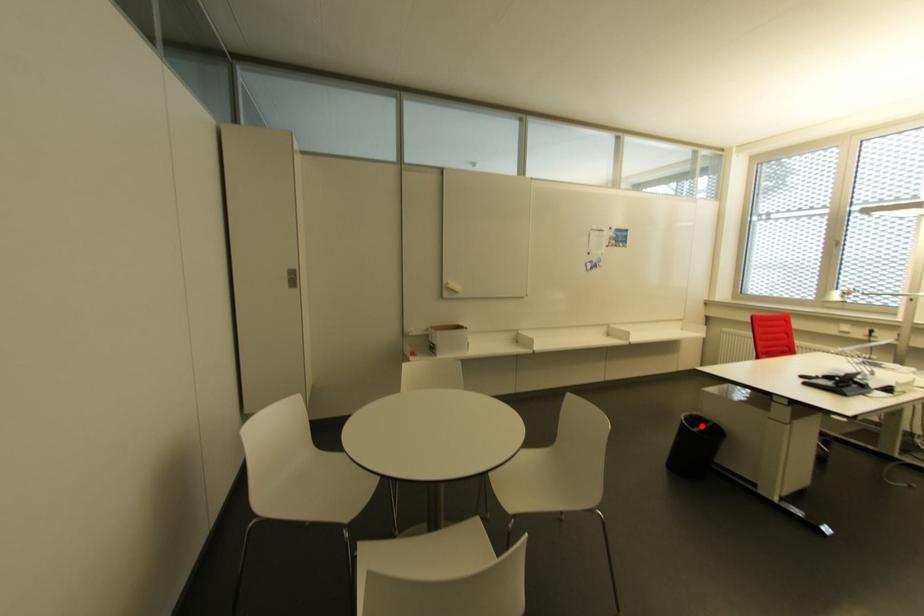
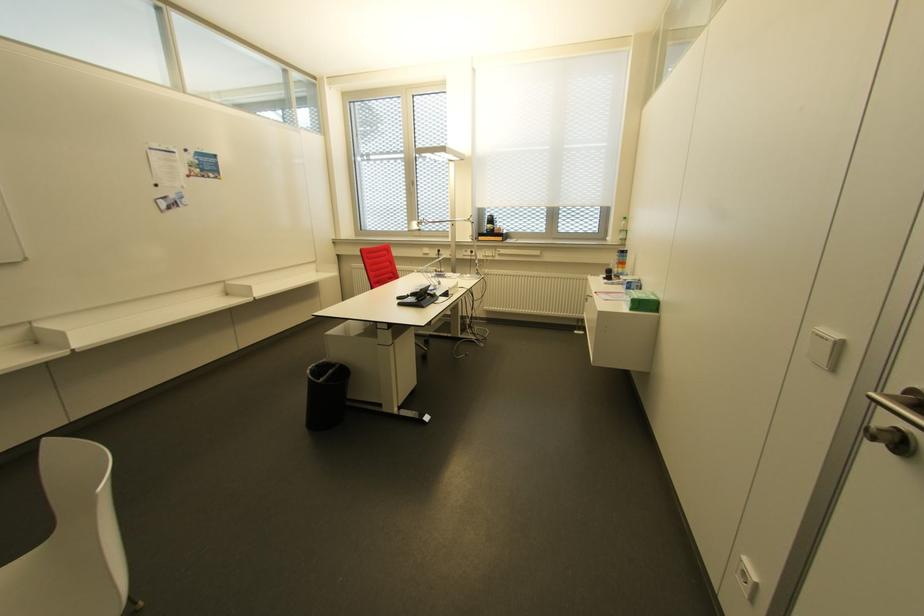
Where in the second image is the point corresponding to the highlighted location from the first image?

(329, 371)